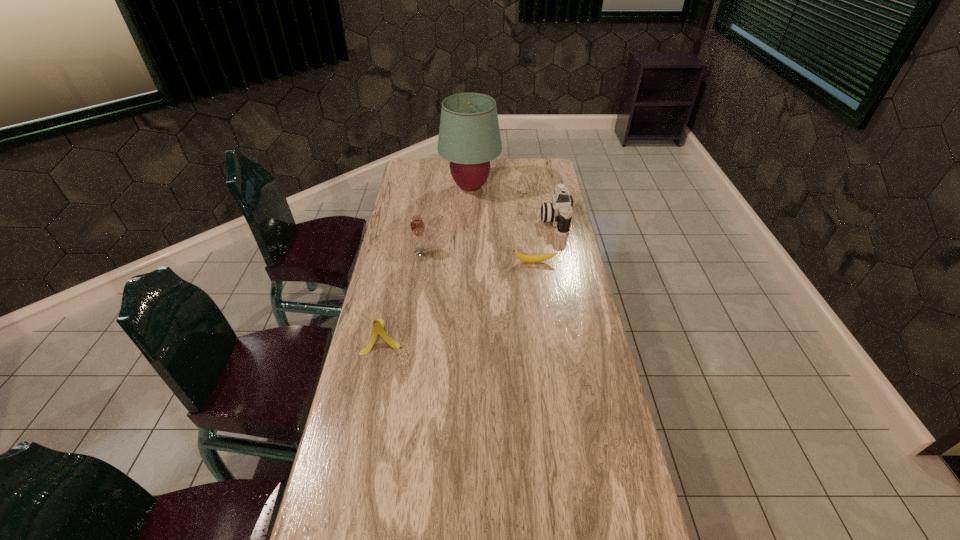
Where is `the third object from right to left`? the third object from right to left is located at coordinates (469, 137).

In order to click on the tallest object in this screenshot , I will do `click(469, 137)`.

Identify the location of the third nearest object. The width and height of the screenshot is (960, 540). click(x=417, y=226).

Where is `the second tallest object`? the second tallest object is located at coordinates (417, 226).

The image size is (960, 540). Find the location of `the second farthest object`. the second farthest object is located at coordinates (559, 212).

Identify the location of the nearer banana. (378, 325).

Find the location of a particular element. This screenshot has height=540, width=960. the second shortest object is located at coordinates (378, 325).

At what (x,y) coordinates should I click in order to perform the action: click on the farther banana. Please return your answer as a coordinate pair (x, y). The image size is (960, 540). Looking at the image, I should click on (526, 258).

Where is `the right banana`? the right banana is located at coordinates (526, 258).

Locate an element on the screen. Image resolution: width=960 pixels, height=540 pixels. vacant space situated 0.100m on the right of the third object from right to left is located at coordinates (522, 187).